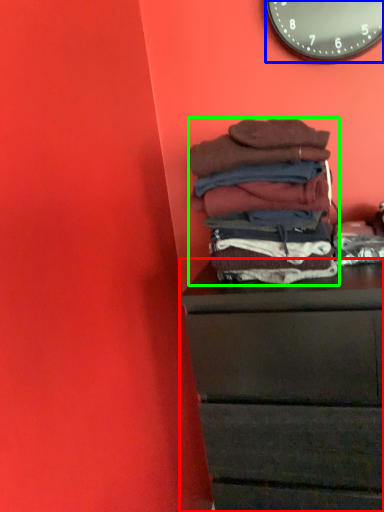
Question: Considering the real-world distances, which object is closest to chest of drawers (highlighted by a red box)? wall clock (highlighted by a blue box) or material (highlighted by a green box).

Choices:
 (A) wall clock
 (B) material

Answer: (B)